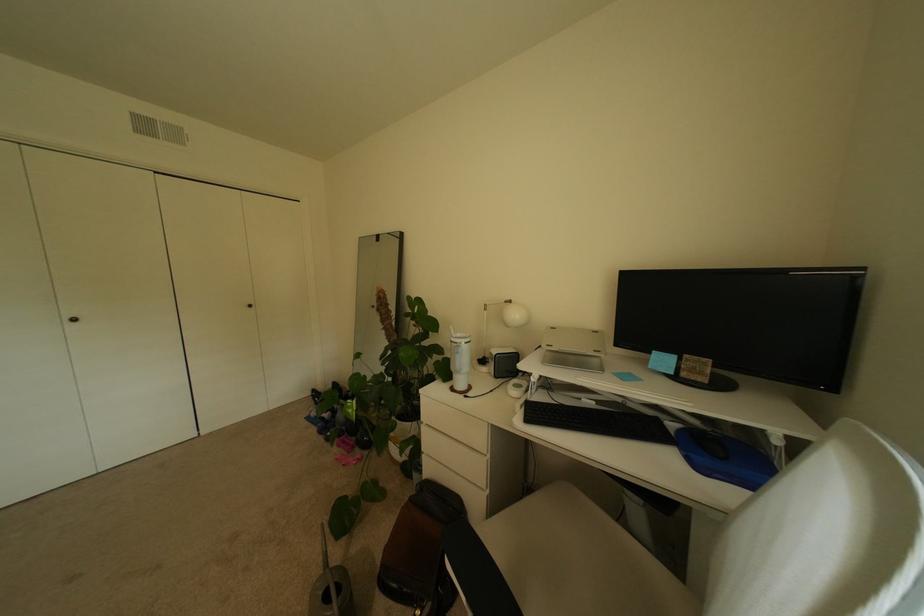
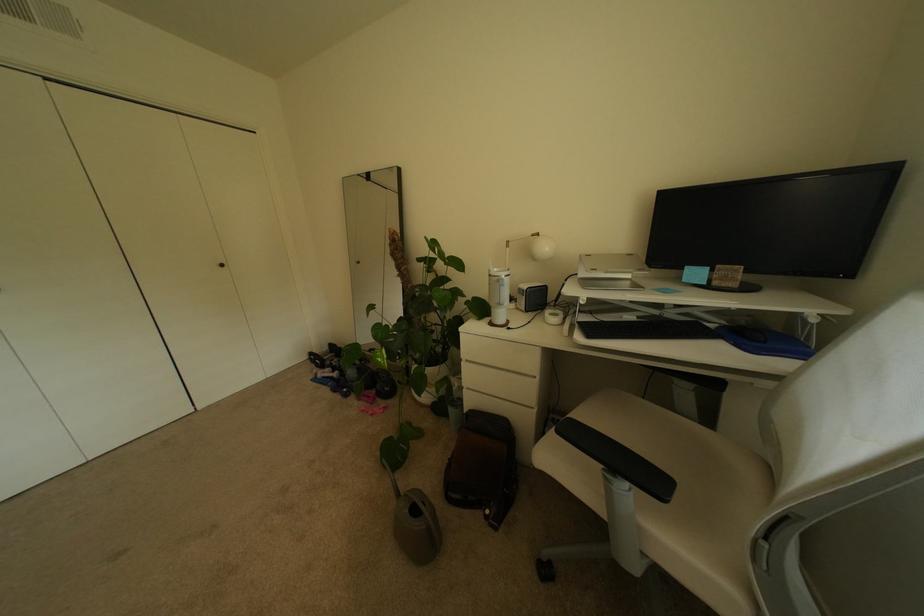
Where in the second image is the point corresponding to (460,390) from the first image?

(500, 325)